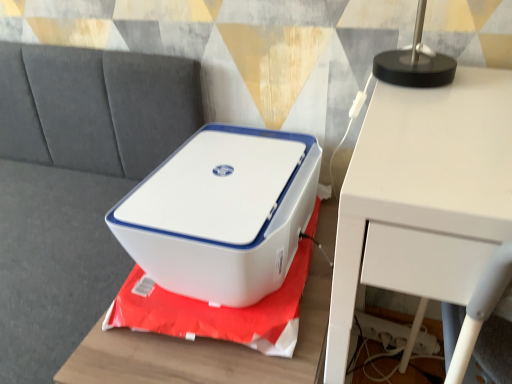
Where is `blank space situated above white plastic printer at center (from a real-world perspective)`? The image size is (512, 384). blank space situated above white plastic printer at center (from a real-world perspective) is located at coordinates (229, 170).